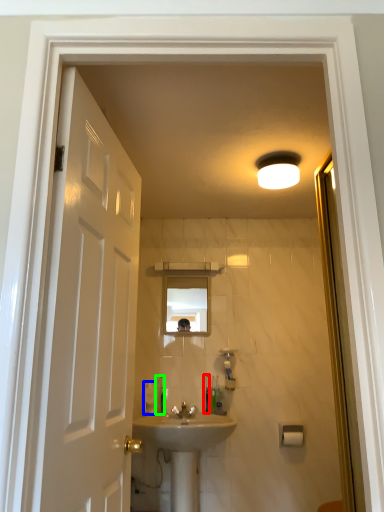
Question: Based on their relative distances, which object is farther from toiletry (highlighted by a red box)? Choose from toiletry (highlighted by a blue box) and toiletry (highlighted by a green box).

Choices:
 (A) toiletry
 (B) toiletry

Answer: (A)